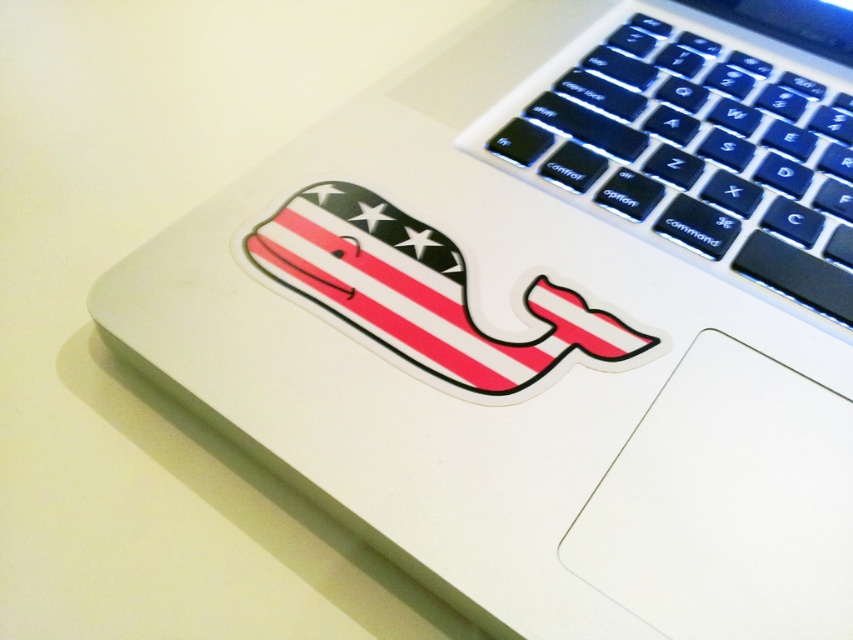
In the scene shown: Does black plastic keyboard at upper right have a greater width compared to american flag whale sticker at center?

Indeed, black plastic keyboard at upper right has a greater width compared to american flag whale sticker at center.

Image resolution: width=853 pixels, height=640 pixels. I want to click on black plastic keyboard at upper right, so click(701, 141).